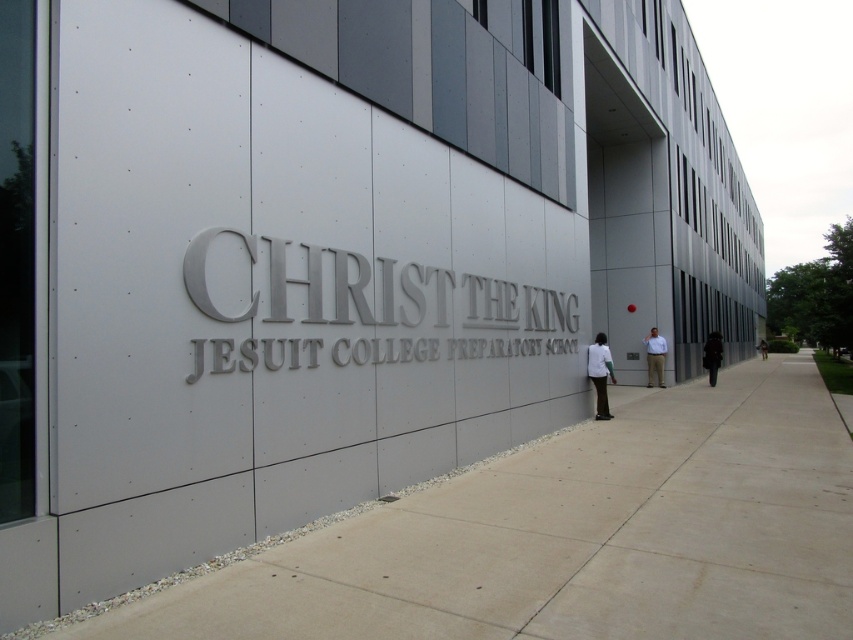
You are standing on the sidewalk in front of Christ the King Jesuit College Preparatory School. You see two points marked on the building facade. The first point is at coordinates point (654, 353) and the second is at point (767, 349). Which point is closer to you?

Point (654, 353) is closer to the viewer than point (767, 349).

You are a photographer standing in front of Christ the King Jesuit College Preparatory School. You notice a white matte shirt at center and a black matte jacket at right. Which clothing item is shorter in height?

The white matte shirt at center is not as tall as the black matte jacket at right, so the white matte shirt at center is shorter in height.

You are a visitor arriving at Christ the King Jesuit College Preparatory School. You see a person standing on the sidewalk in front of the building. The person is wearing the light brown pants at right and the black fabric jacket at right. From your perspective, which clothing item is closer to the left side?

The light brown pants at right is positioned on the left side of the black fabric jacket at right, so the light brown pants at right is closer to the left side.